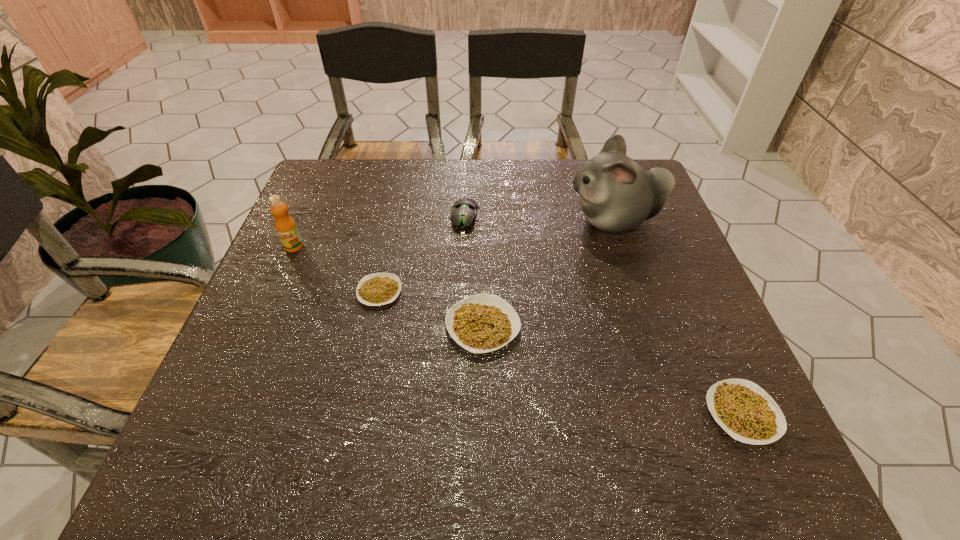
Locate an element on the screen. Image resolution: width=960 pixels, height=540 pixels. free location that satisfies the following two spatial constraints: 1. on the front label of the nearest legume; 2. on the left side of the leftmost object is located at coordinates (221, 414).

Locate an element on the screen. This screenshot has height=540, width=960. blank space that satisfies the following two spatial constraints: 1. on the front side of the tallest legume; 2. on the left side of the rightmost legume is located at coordinates (483, 414).